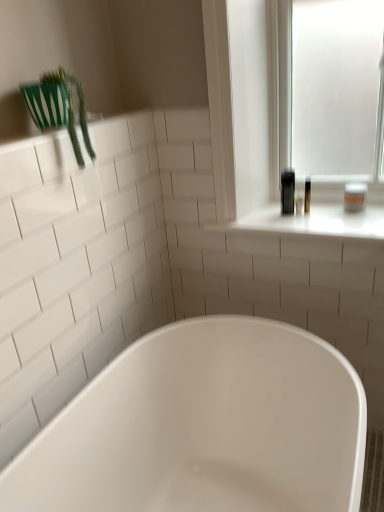
Question: Can you confirm if green plastic plant at upper left is shorter than white glossy window sill at upper right?

Choices:
 (A) no
 (B) yes

Answer: (A)

Question: Is green plastic plant at upper left taller than white glossy window sill at upper right?

Choices:
 (A) no
 (B) yes

Answer: (B)

Question: Does green plastic plant at upper left have a larger size compared to white glossy window sill at upper right?

Choices:
 (A) yes
 (B) no

Answer: (B)

Question: Does green plastic plant at upper left turn towards white glossy window sill at upper right?

Choices:
 (A) yes
 (B) no

Answer: (B)

Question: Is the surface of green plastic plant at upper left in direct contact with white glossy window sill at upper right?

Choices:
 (A) yes
 (B) no

Answer: (B)

Question: Considering their positions, is white matte jar at upper right located in front of or behind white glossy window sill at upper right?

Choices:
 (A) behind
 (B) front

Answer: (A)

Question: From the image's perspective, is white matte jar at upper right positioned above or below white glossy window sill at upper right?

Choices:
 (A) below
 (B) above

Answer: (B)

Question: Considering the relative positions of white matte jar at upper right and white glossy window sill at upper right in the image provided, is white matte jar at upper right to the left or to the right of white glossy window sill at upper right?

Choices:
 (A) left
 (B) right

Answer: (B)

Question: From a real-world perspective, is white matte jar at upper right above or below white glossy window sill at upper right?

Choices:
 (A) below
 (B) above

Answer: (B)

Question: From the image's perspective, is green plastic plant at upper left positioned above or below white glossy bathtub at center?

Choices:
 (A) below
 (B) above

Answer: (B)

Question: Considering their positions, is green plastic plant at upper left located in front of or behind white glossy bathtub at center?

Choices:
 (A) front
 (B) behind

Answer: (B)

Question: From a real-world perspective, is green plastic plant at upper left physically located above or below white glossy bathtub at center?

Choices:
 (A) above
 (B) below

Answer: (A)

Question: In the image, is green plastic plant at upper left on the left side or the right side of white glossy bathtub at center?

Choices:
 (A) right
 (B) left

Answer: (B)

Question: Relative to green plastic plant at upper left, is white glossy bathtub at center in front or behind?

Choices:
 (A) behind
 (B) front

Answer: (B)

Question: In terms of size, does white glossy bathtub at center appear bigger or smaller than green plastic plant at upper left?

Choices:
 (A) small
 (B) big

Answer: (B)